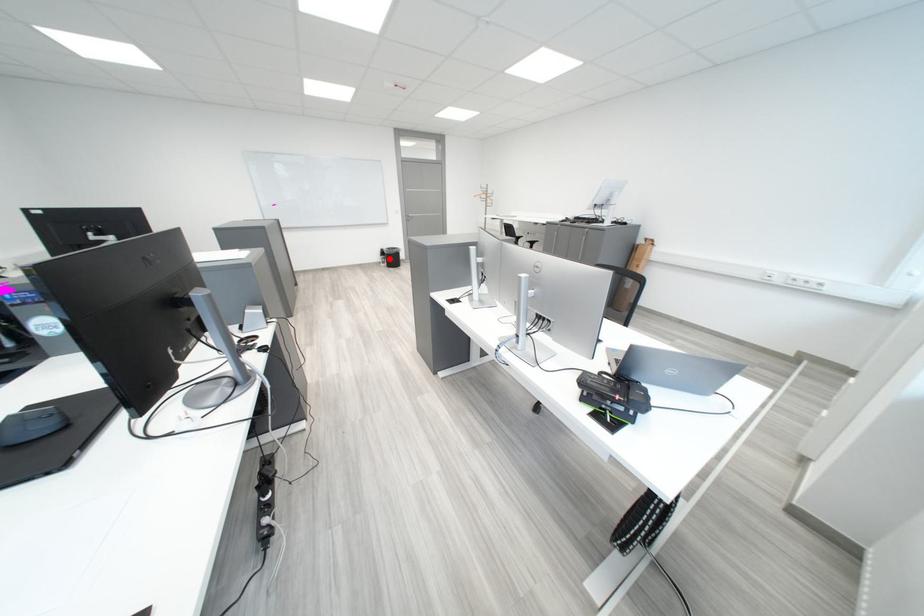
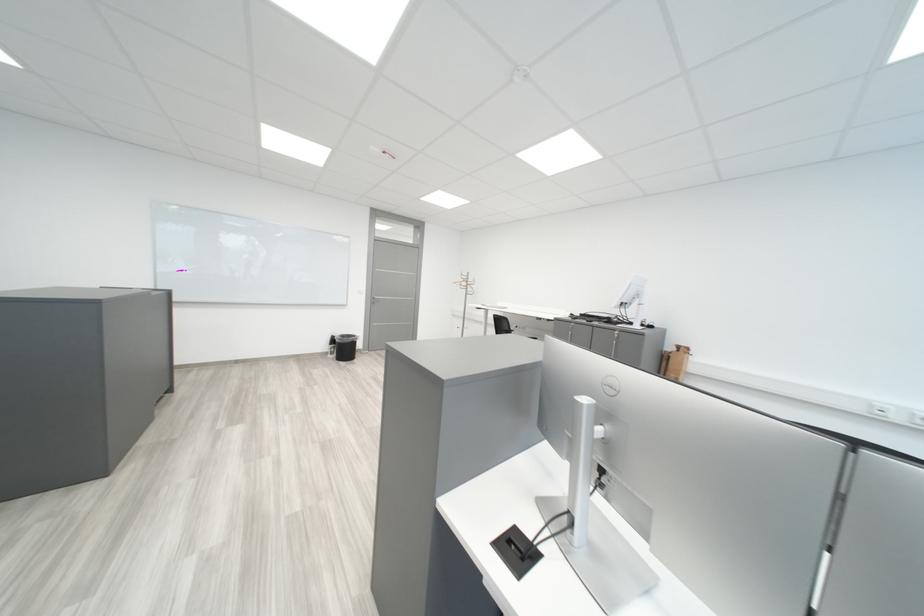
Find the pixel in the second image that matches the highlighted location in the first image.

(336, 347)